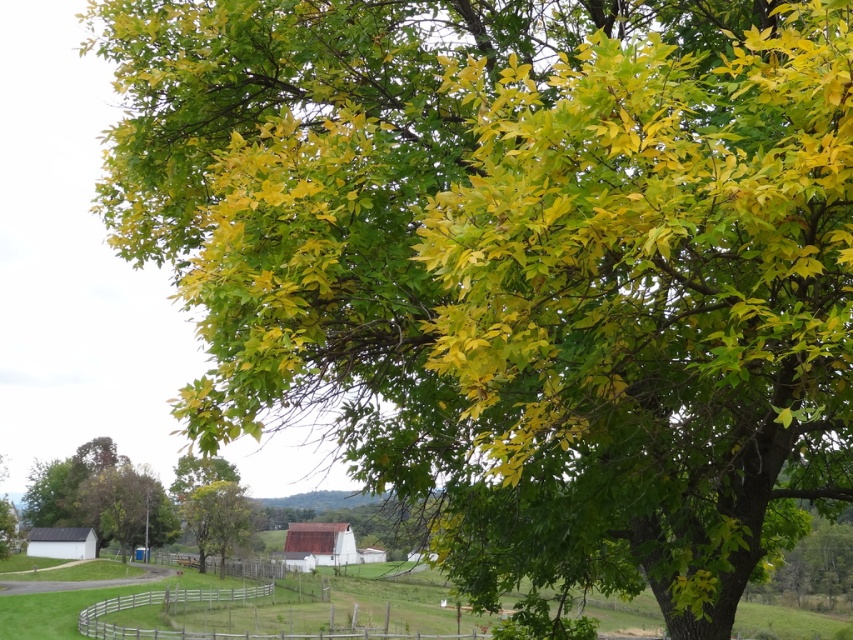
You are standing in the middle of the rural landscape and want to walk towards the wooden at lower center. Which direction should you move relative to the green leafy tree at center?

The wooden at lower center is positioned below the green leafy tree at center. To reach it, you should move downward or southward relative to the tree.

You are standing in the middle of the rural landscape and want to walk towards the green leafy tree at center and the wooden at lower center. Which direction should you face to walk towards both objects?

To walk towards both the green leafy tree at center and the wooden at lower center, you should face towards the right, as the green leafy tree at center is to the right of the wooden at lower center.